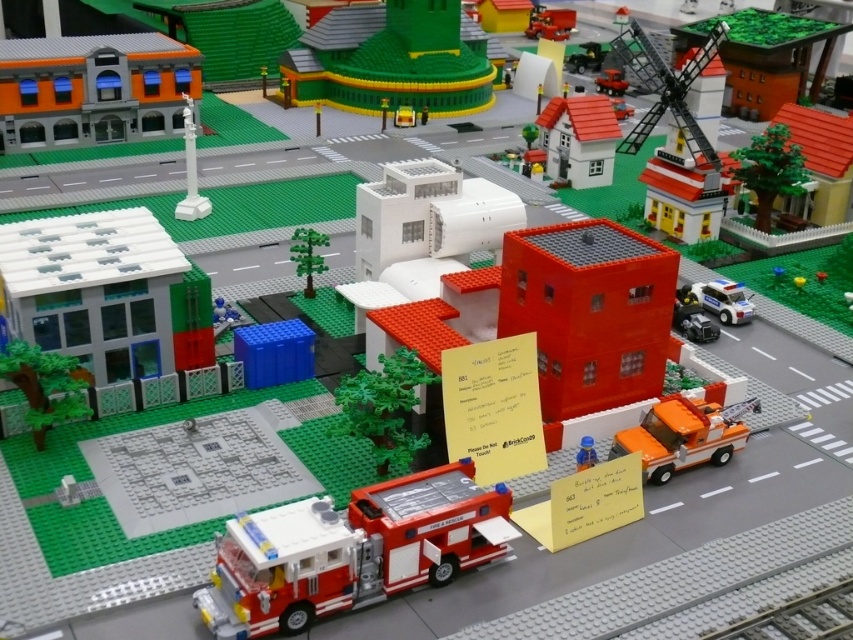
You are a Lego figure trying to reach the top of the green matte tower at upper center and the green matte tree at center. Which one will require more climbing effort due to its height?

The green matte tower at upper center requires more climbing effort because it is bigger than the green matte tree at center.

You are a Lego figure standing at the origin point of the city map. You need to reach the brick red fire truck at lower center as quickly as possible. According to the coordinates provided, in which direction should you move first?

The brick red fire truck at lower center is located at point (351,550). Since the x and y coordinates are both greater than 0.5, you should move towards the right and upward direction first to reach it quickly.

You are a Lego character standing on the grey road. You want to hide behind the green matte tree at center so that the brick red fire truck at lower center cannot see you. Is this possible?

The brick red fire truck at lower center is in front of the green matte tree at center, so hiding behind the green matte tree at center would place you between the fire truck and the tree. This means the fire truck would still be able to see you, making it impossible to hide effectively.